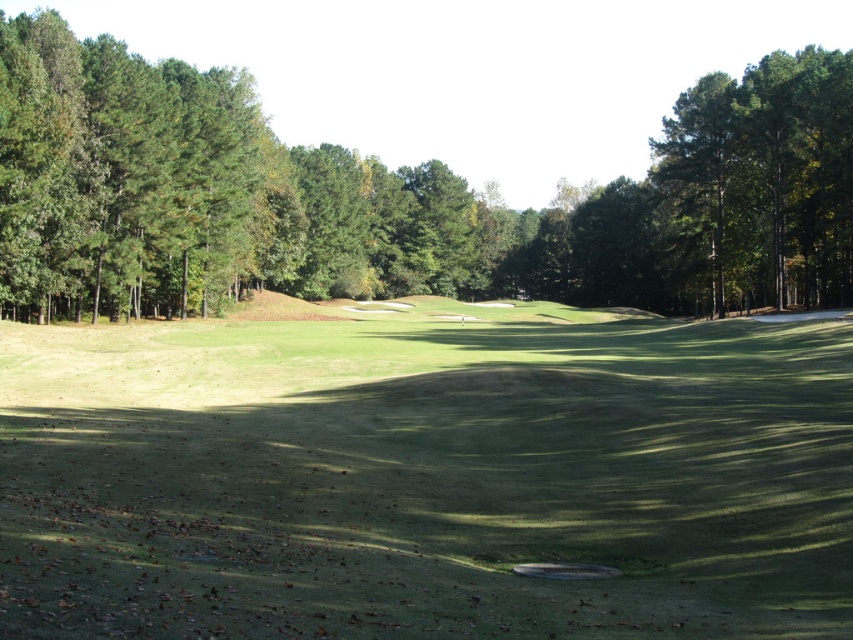
Question: Is green grassy field at center to the left of green leafy tree at center from the viewer's perspective?

Choices:
 (A) yes
 (B) no

Answer: (A)

Question: Can you confirm if green grassy field at center is positioned below green leafy tree at center?

Choices:
 (A) no
 (B) yes

Answer: (B)

Question: Which point is closer to the camera?

Choices:
 (A) green leafy tree at center
 (B) green grassy field at center

Answer: (B)

Question: Which point is closer to the camera?

Choices:
 (A) green grassy field at center
 (B) green leafy tree at center

Answer: (A)

Question: Is green grassy field at center above green leafy tree at center?

Choices:
 (A) no
 (B) yes

Answer: (A)